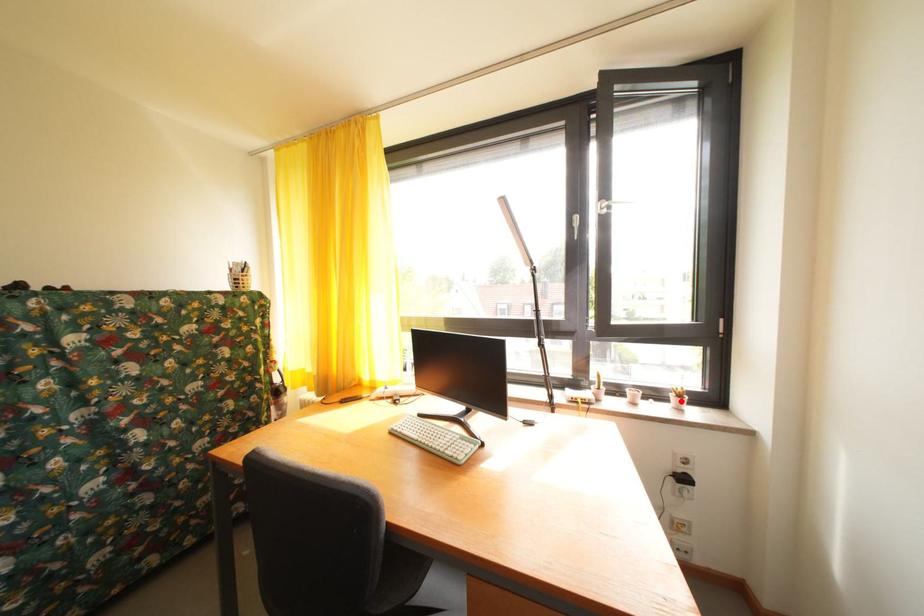
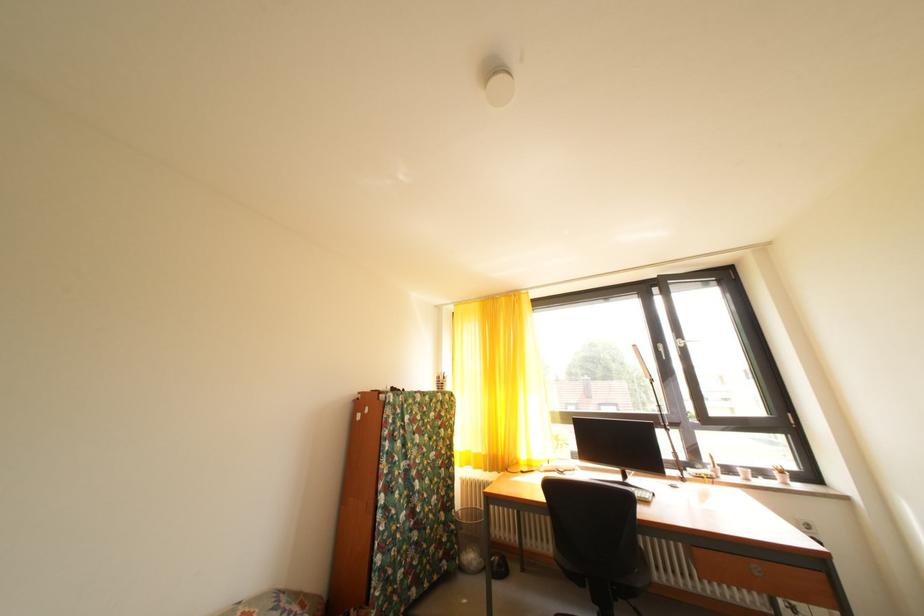
Find the pixel in the second image that matches the highlighted location in the first image.

(784, 479)